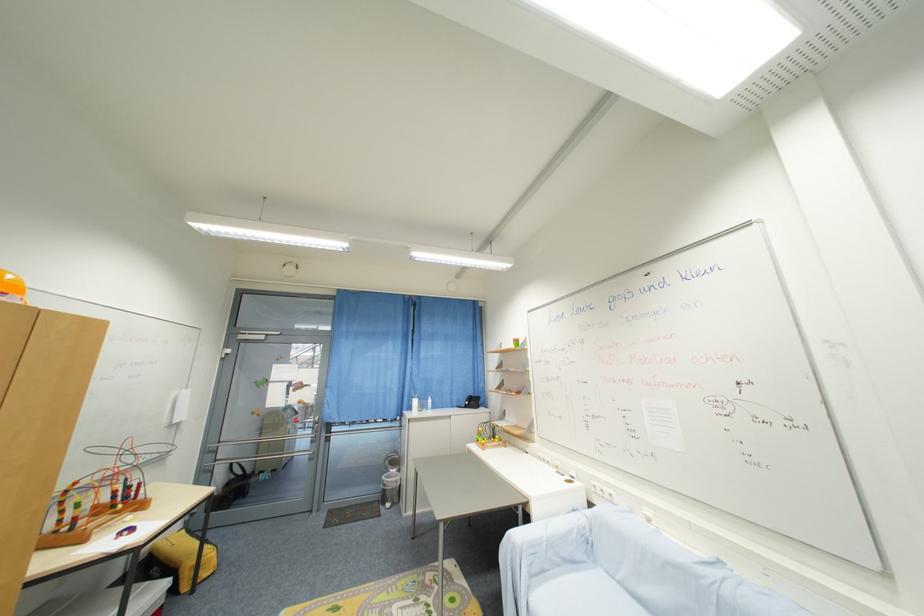
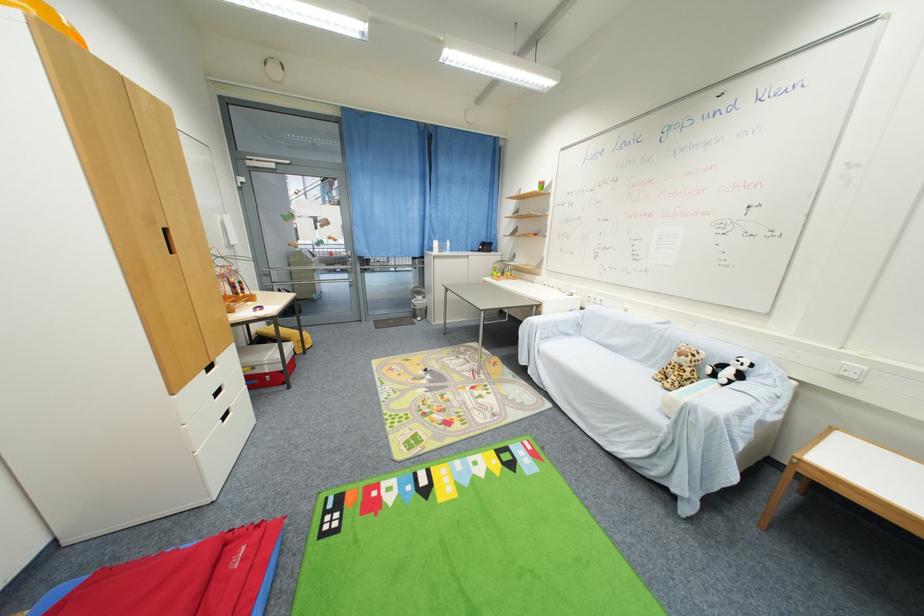
In the second image, find the point that corresponds to [517,347] in the first image.

(541, 190)